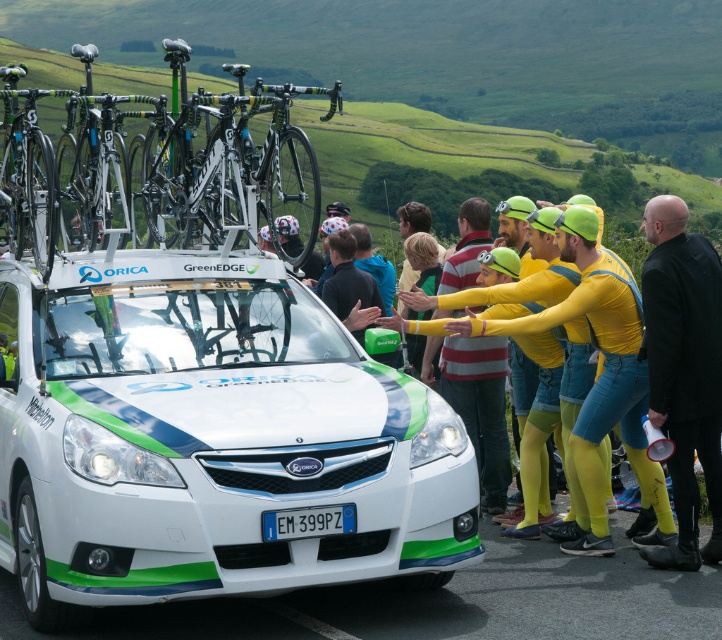
Question: Which is farther from the yellow spandex at center?

Choices:
 (A) white matte bicycle helmet at center
 (B) shiny black bike at left
 (C) matte black helmet at center
 (D) white glossy car at center

Answer: (B)

Question: Based on their relative distances, which object is farther from the yellow spandex at center?

Choices:
 (A) matte yellow helmet at center
 (B) white glossy car at center
 (C) shiny black bike at upper left
 (D) matte black helmet at center

Answer: (C)

Question: Which point is farther from the camera taking this photo?

Choices:
 (A) [321, 227]
 (B) [513, 276]
 (C) [477, 349]

Answer: (A)

Question: From the image, what is the correct spatial relationship of shiny black bike at upper left in relation to yellow spandex at center?

Choices:
 (A) right
 (B) left

Answer: (B)

Question: Does matte black helmet at center come behind white matte bicycle helmet at center?

Choices:
 (A) yes
 (B) no

Answer: (A)

Question: In this image, where is shiny black bike at upper left located relative to white matte bicycle helmet at center?

Choices:
 (A) below
 (B) above

Answer: (B)